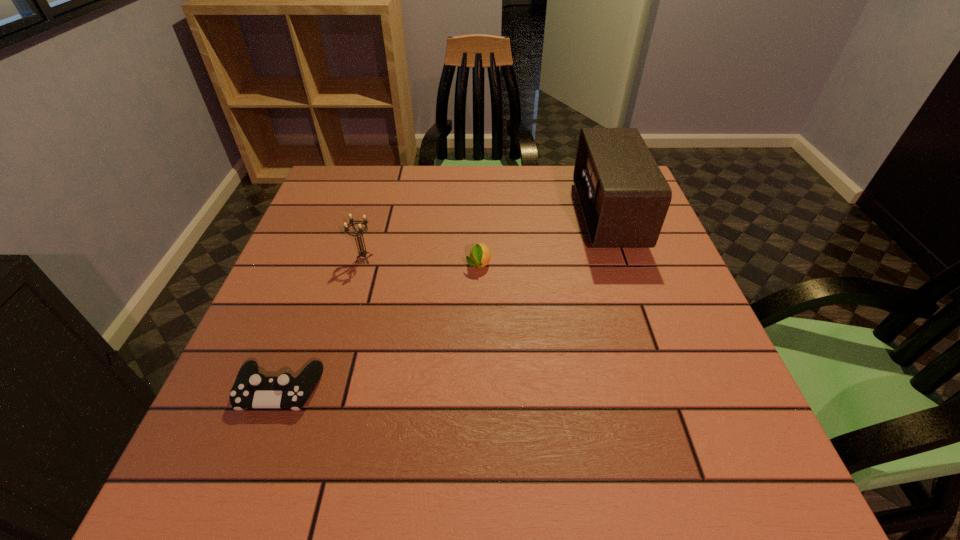
You are a GUI agent. You are given a task and a screenshot of the screen. Output one action in this format:
    pyautogui.click(x=<x>, y=<y>)
    Task: Click on the radio receiver
    The width and height of the screenshot is (960, 540).
    Given the screenshot: What is the action you would take?
    pyautogui.click(x=624, y=197)

Where is `the rightmost object`? the rightmost object is located at coordinates (624, 197).

Where is `the second tallest object`? the second tallest object is located at coordinates (362, 253).

Identify the location of lemon. point(480,255).

I want to click on the nearest object, so click(251, 389).

The image size is (960, 540). Find the location of `vacant position located on the front-facing side of the radio receiver`. vacant position located on the front-facing side of the radio receiver is located at coordinates [x=465, y=215].

You are a GUI agent. You are given a task and a screenshot of the screen. Output one action in this format:
    pyautogui.click(x=<x>, y=<y>)
    Task: Click on the vacant space situated 0.370m on the front-facing side of the radio receiver
    The height and width of the screenshot is (540, 960).
    Given the screenshot: What is the action you would take?
    pyautogui.click(x=443, y=215)

At what (x,y) coordinates should I click in order to perform the action: click on free space located 0.320m on the front-facing side of the radio receiver. Please return your answer as a coordinate pair (x, y). Looking at the image, I should click on (461, 215).

You are a GUI agent. You are given a task and a screenshot of the screen. Output one action in this format:
    pyautogui.click(x=<x>, y=<y>)
    Task: Click on the free location located 0.050m on the right of the second tallest object
    The height and width of the screenshot is (540, 960).
    Given the screenshot: What is the action you would take?
    pyautogui.click(x=396, y=259)

This screenshot has width=960, height=540. In order to click on free space located 0.100m with leaves positioned above the lemon in this screenshot , I will do `click(478, 309)`.